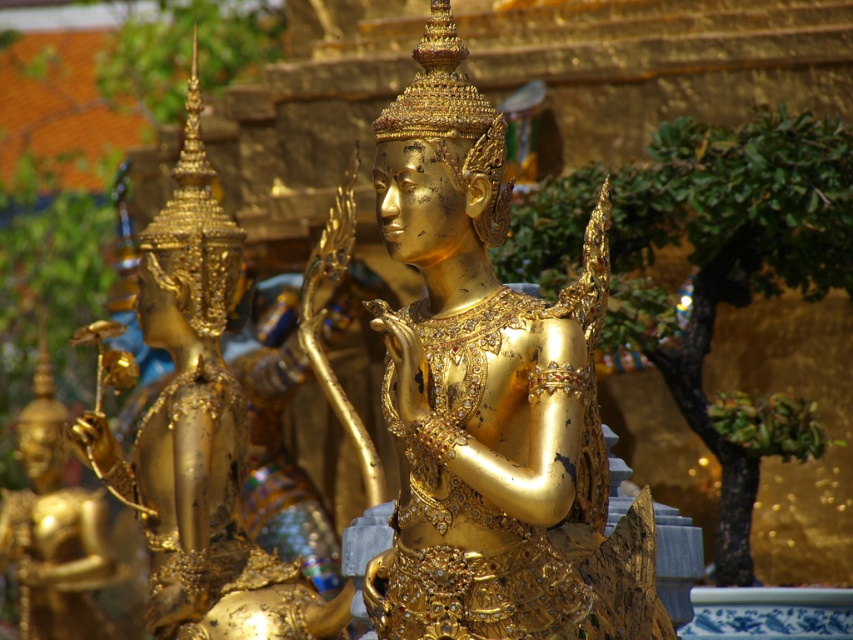
Question: Does shiny gold statue at center have a greater width compared to gold polished statue at center?

Choices:
 (A) no
 (B) yes

Answer: (A)

Question: In this image, where is shiny gold statue at center located relative to gold polished statue at center?

Choices:
 (A) below
 (B) above

Answer: (B)

Question: Is shiny gold statue at center above gold polished statue at center?

Choices:
 (A) no
 (B) yes

Answer: (B)

Question: Among these points, which one is nearest to the camera?

Choices:
 (A) (207, 579)
 (B) (450, 81)

Answer: (B)